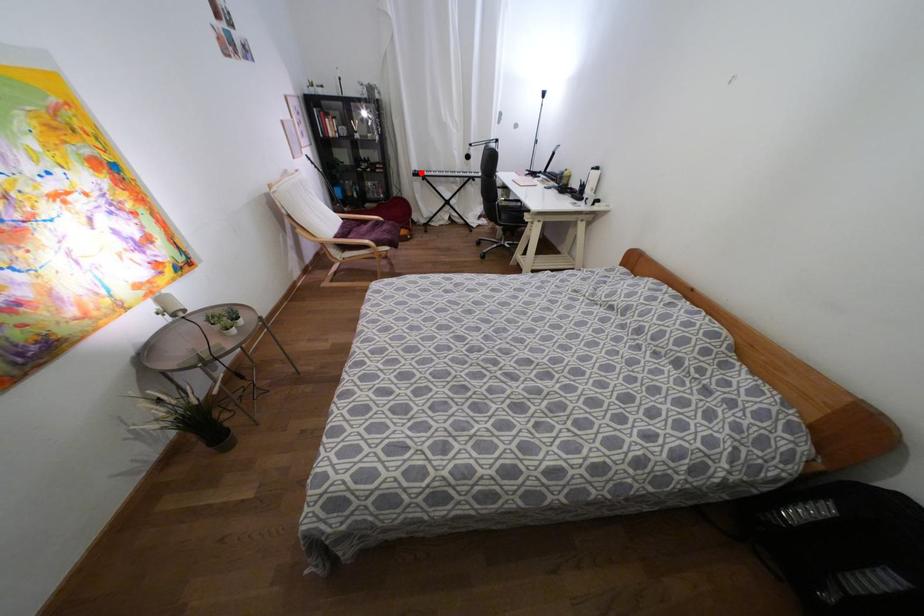
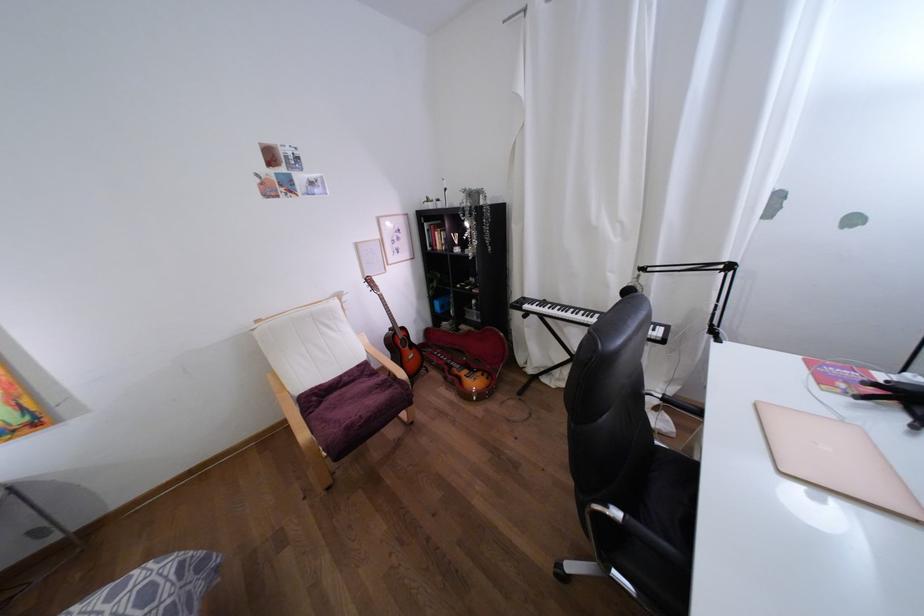
Question: I am providing you with two images of the same scene from different viewpoints. A red point is marked on the first image. Is the red point's position out of view in image 2?

Choices:
 (A) Yes
 (B) No

Answer: (B)